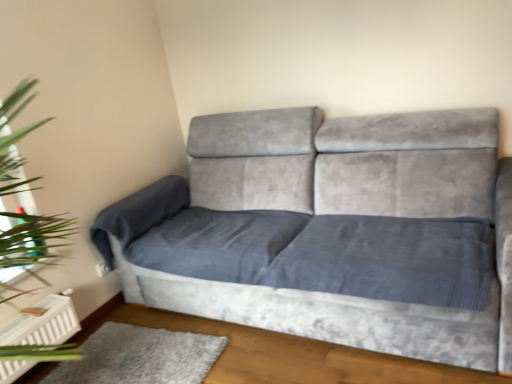
Question: From a real-world perspective, is teal glass at left physically above green leafy plant at left?

Choices:
 (A) no
 (B) yes

Answer: (A)

Question: Is teal glass at left to the right of green leafy plant at left from the viewer's perspective?

Choices:
 (A) yes
 (B) no

Answer: (A)

Question: Is the depth of teal glass at left less than that of green leafy plant at left?

Choices:
 (A) yes
 (B) no

Answer: (B)

Question: Does teal glass at left turn towards green leafy plant at left?

Choices:
 (A) yes
 (B) no

Answer: (A)

Question: Is teal glass at left smaller than green leafy plant at left?

Choices:
 (A) yes
 (B) no

Answer: (A)

Question: Is teal glass at left shorter than green leafy plant at left?

Choices:
 (A) yes
 (B) no

Answer: (A)

Question: Considering the relative positions of teal glass at left and velvet grey couch at center in the image provided, is teal glass at left behind velvet grey couch at center?

Choices:
 (A) no
 (B) yes

Answer: (B)

Question: Is teal glass at left taller than velvet grey couch at center?

Choices:
 (A) yes
 (B) no

Answer: (B)

Question: Can you confirm if teal glass at left is bigger than velvet grey couch at center?

Choices:
 (A) yes
 (B) no

Answer: (B)

Question: Can you confirm if teal glass at left is positioned to the right of velvet grey couch at center?

Choices:
 (A) no
 (B) yes

Answer: (A)

Question: From a real-world perspective, is teal glass at left positioned over velvet grey couch at center based on gravity?

Choices:
 (A) no
 (B) yes

Answer: (B)

Question: Is teal glass at left not near velvet grey couch at center?

Choices:
 (A) yes
 (B) no

Answer: (A)

Question: From a real-world perspective, is green leafy plant at left beneath gray plush rug at lower left?

Choices:
 (A) yes
 (B) no

Answer: (B)